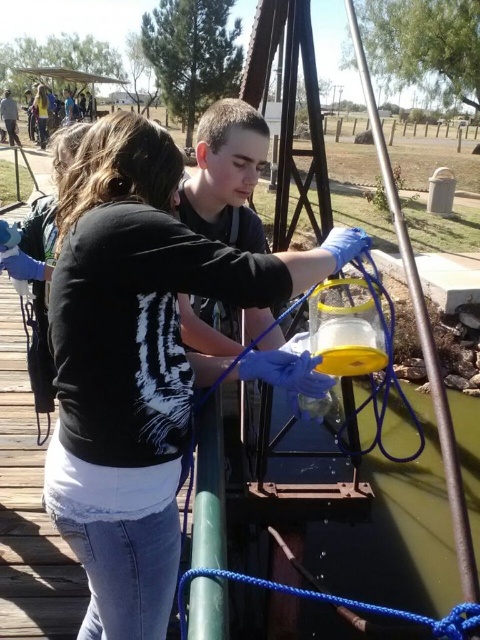
Is blue braided rope at lower center thinner than gray fabric shirt at upper left?

Yes.

Between blue braided rope at lower center and gray fabric shirt at upper left, which one has less height?

blue braided rope at lower center

Between point (276, 589) and point (3, 122), which one is positioned in front?

Point (276, 589) is in front.

Find the location of a particular element. blue braided rope at lower center is located at coordinates (340, 604).

The image size is (480, 640). Find the location of `matte black shirt at center`. matte black shirt at center is located at coordinates (139, 362).

Which is behind, point (159, 161) or point (4, 102)?

Point (4, 102)

Locate an element on the screen. matte black shirt at center is located at coordinates (139, 362).

Does matte black shirt at center appear on the right side of blue braided rope at lower center?

No, matte black shirt at center is not to the right of blue braided rope at lower center.

Does matte black shirt at center have a greater height compared to blue braided rope at lower center?

Correct, matte black shirt at center is much taller as blue braided rope at lower center.

Which is in front, point (78, 348) or point (235, 572)?

Positioned in front is point (78, 348).

Identify the location of matte black shirt at center. Image resolution: width=480 pixels, height=640 pixels. (139, 362).